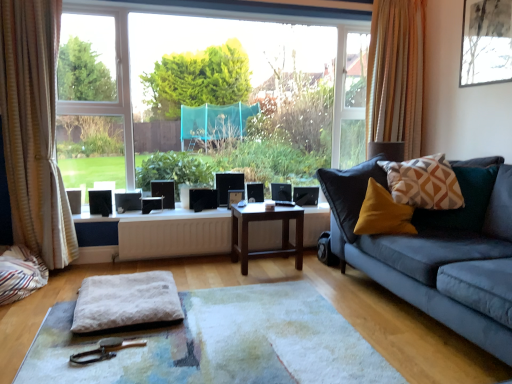
This screenshot has width=512, height=384. Find the location of `free space that is in between white soft cushion at center and white fluffy footrest at center`. free space that is in between white soft cushion at center and white fluffy footrest at center is located at coordinates (215, 284).